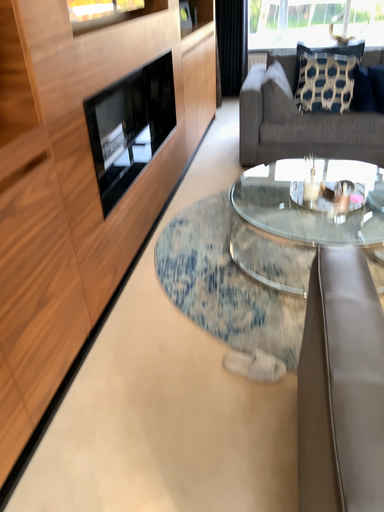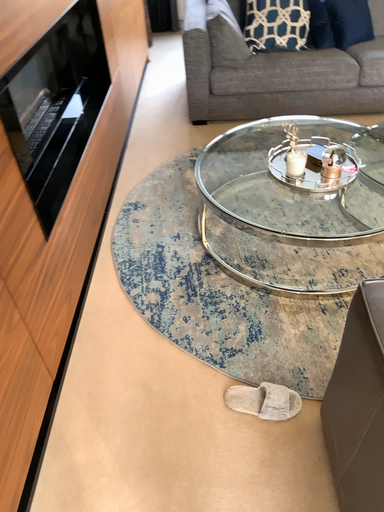
Question: Which way did the camera rotate in the video?

Choices:
 (A) rotated upward
 (B) rotated downward

Answer: (B)